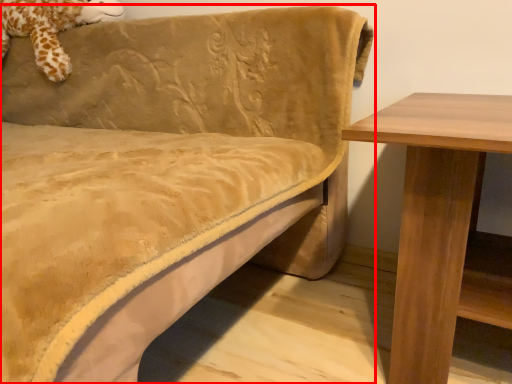
Question: From the image's perspective, where is studio couch (annotated by the red box) located relative to animal?

Choices:
 (A) above
 (B) below

Answer: (B)